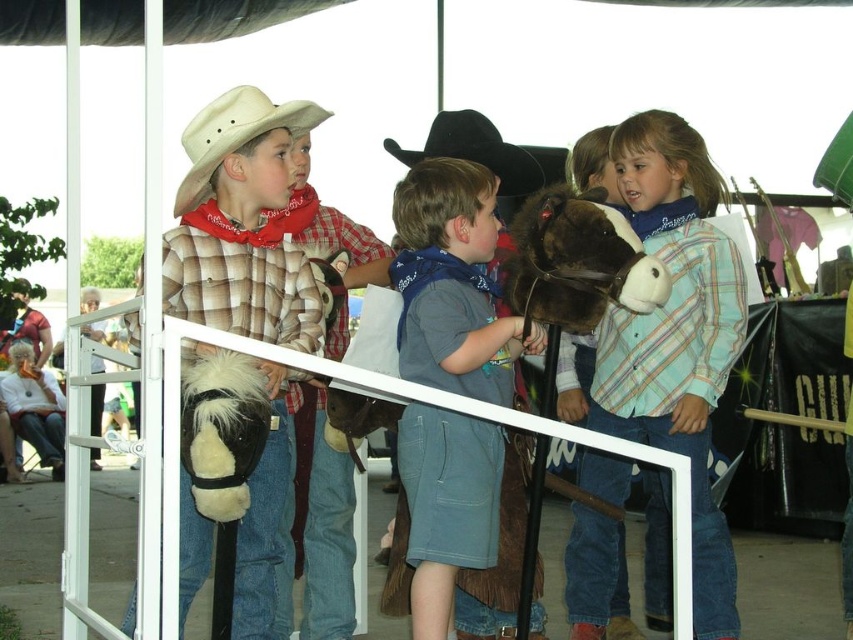
Question: Considering the real-world distances, which object is closest to the black felt cowboy hat at center?

Choices:
 (A) brown plush horse at center
 (B) blue denim shorts at center
 (C) plaid shirt at center

Answer: (A)

Question: Is the position of blue denim shorts at center more distant than that of brown plush horse at center?

Choices:
 (A) no
 (B) yes

Answer: (B)

Question: Which object appears closest to the camera in this image?

Choices:
 (A) plaid shirt at center
 (B) blue denim shorts at center
 (C) beige felt cowboy hat at left
 (D) plaid shirt at left

Answer: (D)

Question: Which is farther from the blue denim shorts at center?

Choices:
 (A) plaid shirt at left
 (B) brown plush horse at center

Answer: (A)

Question: Is plaid shirt at left bigger than brown plush horse at center?

Choices:
 (A) yes
 (B) no

Answer: (A)

Question: Is brown plush horse at center further to the viewer compared to black felt cowboy hat at center?

Choices:
 (A) yes
 (B) no

Answer: (B)